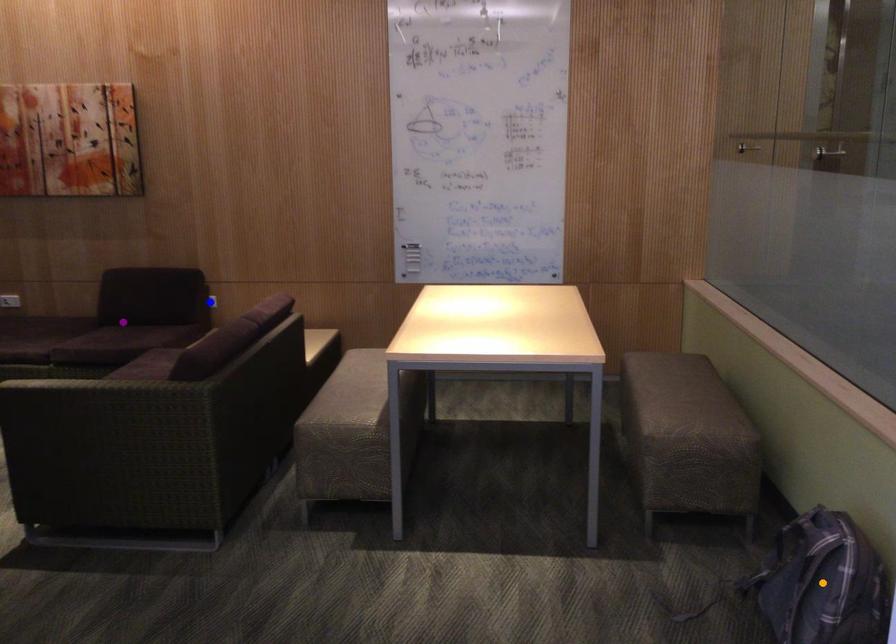
Order these from nearest to farthest:
- purple point
- blue point
- orange point

orange point
purple point
blue point